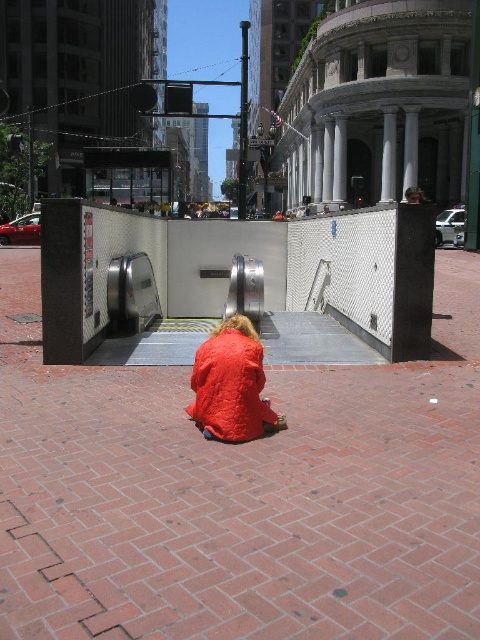
You are a delivery person trying to place a package on the ground near the quilted orange coat at center. Can you place the package on the brick pavement at center without moving the coat?

The brick pavement at center is positioned under quilted orange coat at center, so yes, the package can be placed on the brick pavement at center since it is directly underneath the coat.